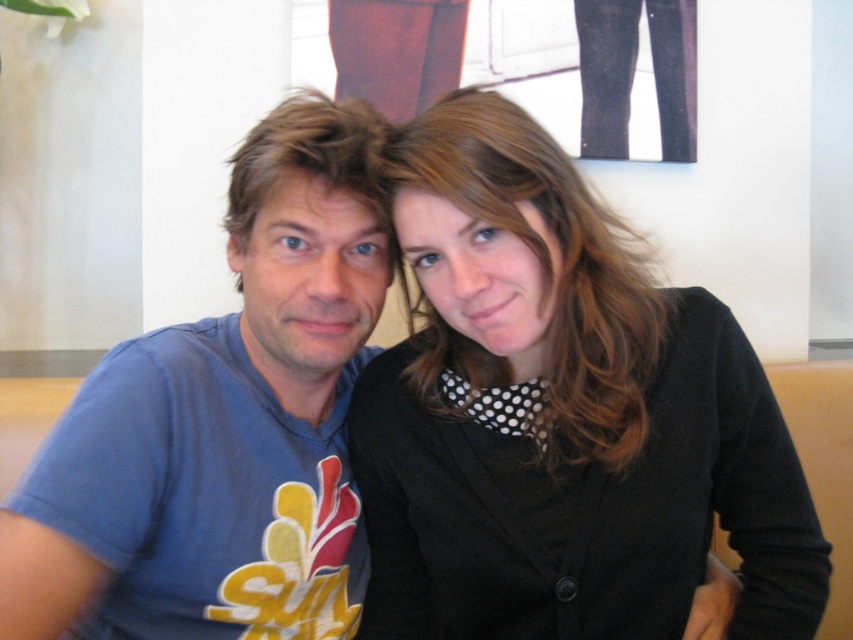
Question: Can you confirm if black matte cardigan at center is positioned to the right of brownhair at left?

Choices:
 (A) no
 (B) yes

Answer: (B)

Question: Can you confirm if blue cotton t-shirt at left is bigger than brownhair at left?

Choices:
 (A) no
 (B) yes

Answer: (B)

Question: Which point appears farthest from the camera in this image?

Choices:
 (A) (572, 205)
 (B) (241, 179)

Answer: (B)

Question: Can you confirm if black matte cardigan at center is positioned to the left of brownsmoothhair at center?

Choices:
 (A) no
 (B) yes

Answer: (B)

Question: Which is nearer to the brownhair at left?

Choices:
 (A) blue cotton t-shirt at left
 (B) black matte cardigan at center
 (C) brownsmoothhair at center

Answer: (A)

Question: Which object appears farthest from the camera in this image?

Choices:
 (A) blue cotton t-shirt at left
 (B) brownsmoothhair at center
 (C) black matte cardigan at center

Answer: (A)